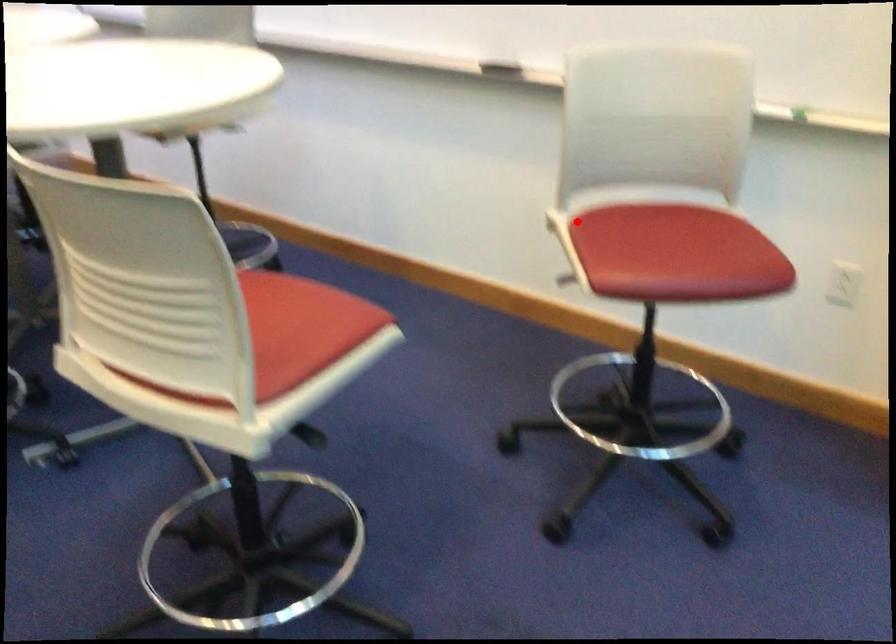
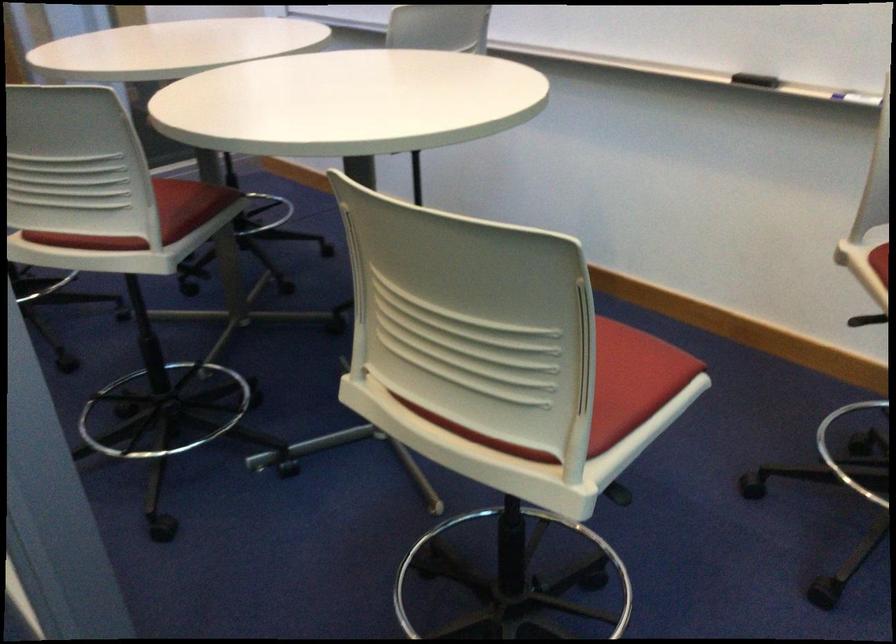
The point at the highlighted location is marked in the first image. Where is the corresponding point in the second image?

(880, 261)